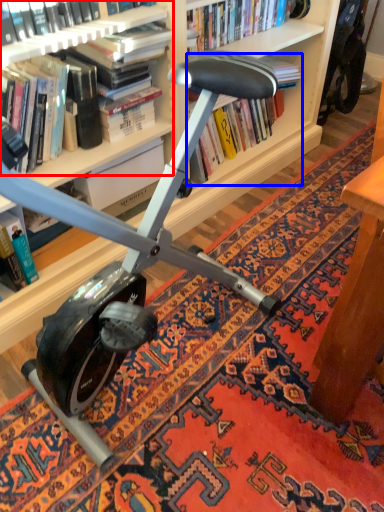
Question: Which point is further to the camera, book (highlighted by a red box) or book (highlighted by a blue box)?

Choices:
 (A) book
 (B) book

Answer: (B)